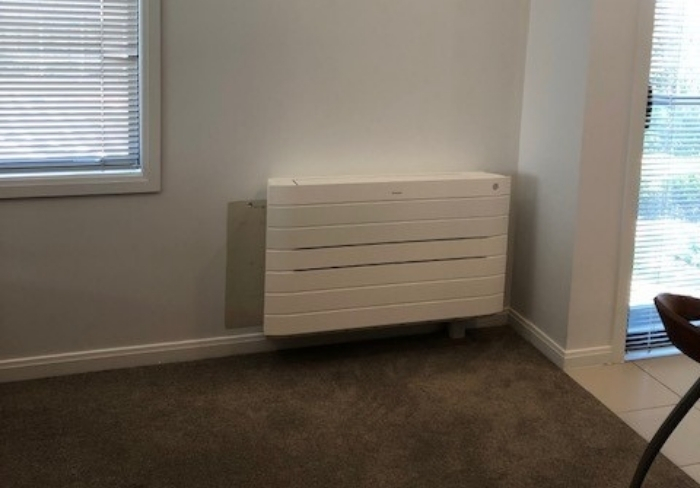
Locate an element on the screen. The image size is (700, 488). brown carpet is located at coordinates tap(203, 417).